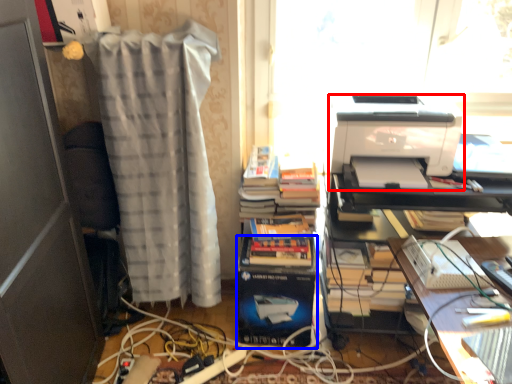
Question: Which object is further to the camera taking this photo, printer (highlighted by a red box) or paperback book (highlighted by a blue box)?

Choices:
 (A) printer
 (B) paperback book

Answer: (B)